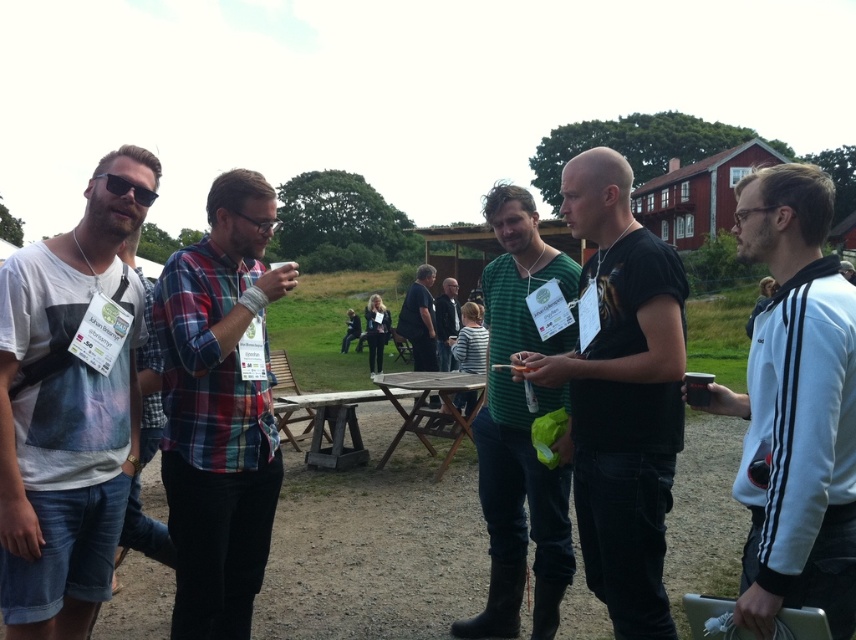
Question: Is white fleece jacket at right positioned at the back of green textured shirt at center?

Choices:
 (A) yes
 (B) no

Answer: (B)

Question: Is black matte t-shirt at center above green textured shirt at center?

Choices:
 (A) yes
 (B) no

Answer: (A)

Question: Estimate the real-world distances between objects in this image. Which object is closer to the matte black sunglasses at left?

Choices:
 (A) striped cotton shirt at center
 (B) black matte t-shirt at center
 (C) green striped shirt at center
 (D) green textured shirt at center

Answer: (B)

Question: Which object appears farthest from the camera in this image?

Choices:
 (A) matte black sunglasses at left
 (B) black matte t-shirt at center
 (C) green striped shirt at center

Answer: (C)

Question: Based on their relative distances, which object is nearer to the striped cotton shirt at center?

Choices:
 (A) plaid fabric shirt at center
 (B) green textured shirt at center
 (C) white fleece jacket at right

Answer: (B)

Question: Does plaid fabric shirt at center have a lesser width compared to green textured shirt at center?

Choices:
 (A) no
 (B) yes

Answer: (A)